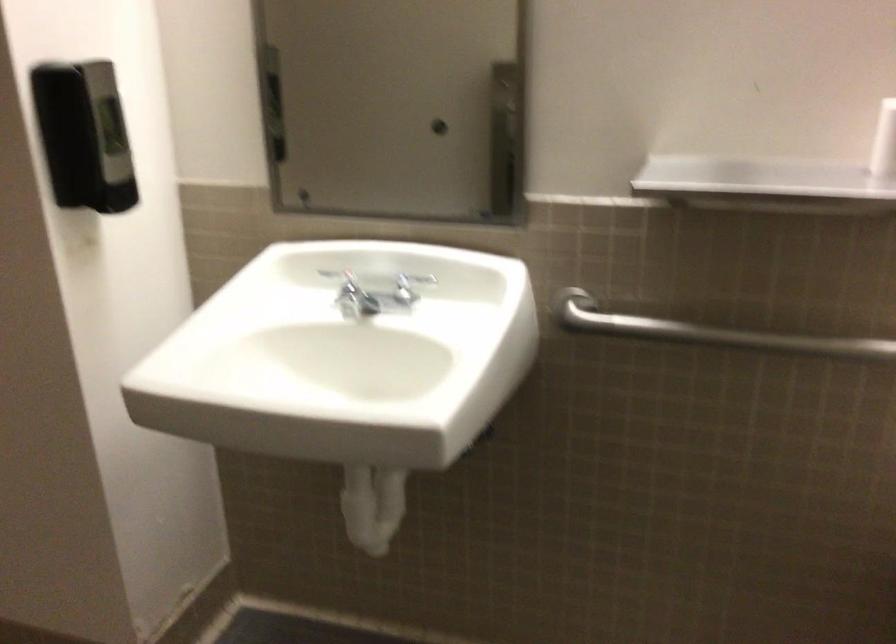
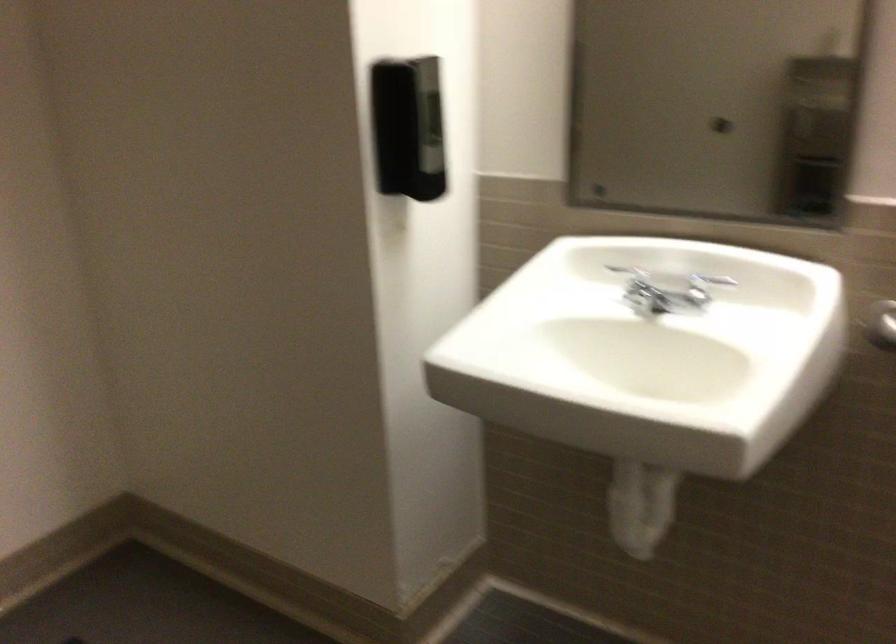
In the second image, find the point that corresponds to (411,287) in the first image.

(704, 287)